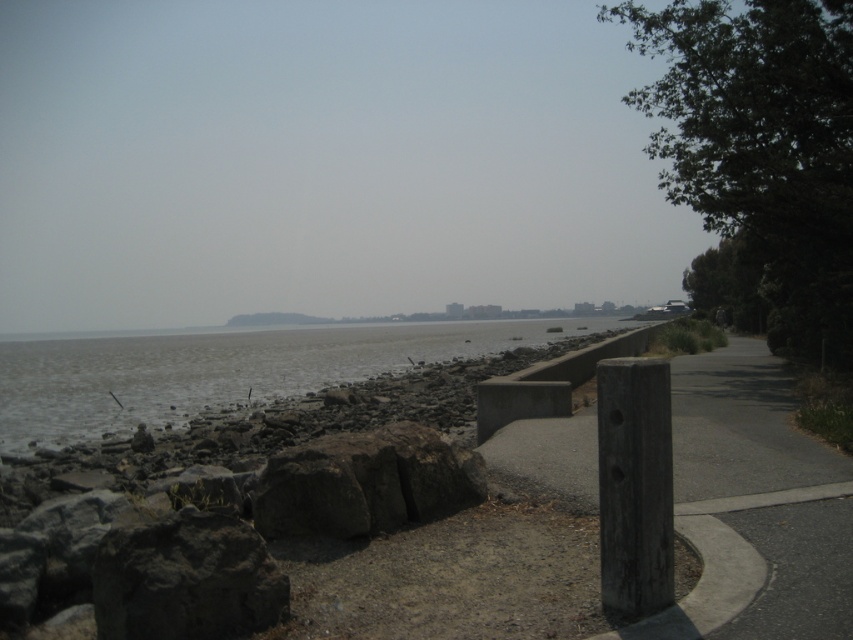
You are a hiker who wants to take a shortcut from the dark gray rough stone at lower left to the dark gray rock at center. Can you walk directly between them?

The dark gray rough stone at lower left is to the left of dark gray rock at center, so yes, you can walk directly between them as there is no obstruction mentioned in the scene description.

You are standing at point (184, 579) on a coastal path and notice a dark gray rough stone at lower left. What is the nearest object to you?

The nearest object to you is the dark gray rough stone at lower left located at point (184, 579).